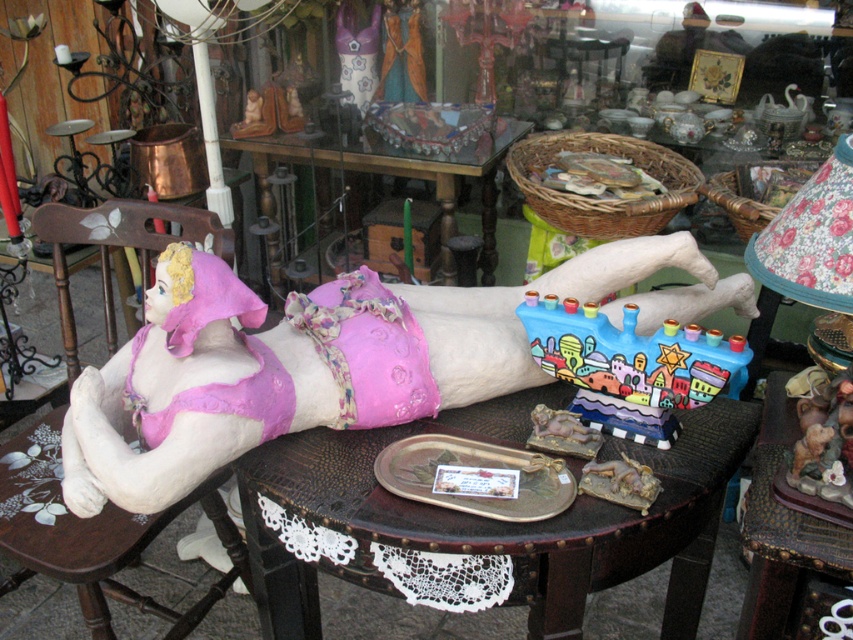
What object is located at the coordinates point (154, 413) in the image?

The pink fabric doll at center is located at point (154, 413).

You are setting up a display at a flea market and need to place a 10 inch wide decorative item between the pink fabric doll at center and the painted ceramic menorah at center. Is there enough space between them to fit this item?

The distance between the pink fabric doll at center and the painted ceramic menorah at center is 8.61 inches. Since the decorative item is 10 inches wide, it would not fit in the available space.

You are organizing a display in a small shop and need to place the pink fabric doll at center and the painted ceramic menorah at center on a shelf that can only hold items up to the width of the menorah. Can both items fit on the shelf?

The pink fabric doll at center is wider than the painted ceramic menorah at center. Since the shelf can only hold items up to the width of the menorah, the doll is too wide to fit. Only the menorah can be placed on the shelf.